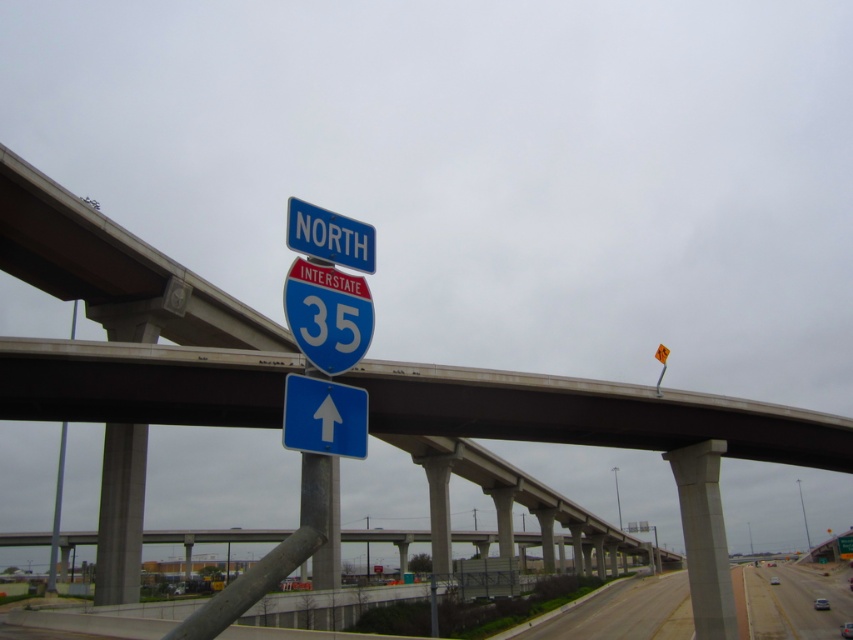
You are a delivery driver needing to pass between the blue glossy arrow at center and the blue plastic sign at upper center with your truck, which is 1.6 meters wide. Can your truck fit through the space between them?

The distance between the blue glossy arrow at center and the blue plastic sign at upper center is 1.72 meters, so yes, the truck can fit through since it is wider than the truck by 0.12 meters.

You are a truck driver planning to pass through the area shown in the image. You notice the blue plastic sign at upper center and the metallic gray pole at left. Which object is narrower in width?

The blue plastic sign at upper center has a lesser width compared to the metallic gray pole at left, so the blue plastic sign at upper center is narrower in width.